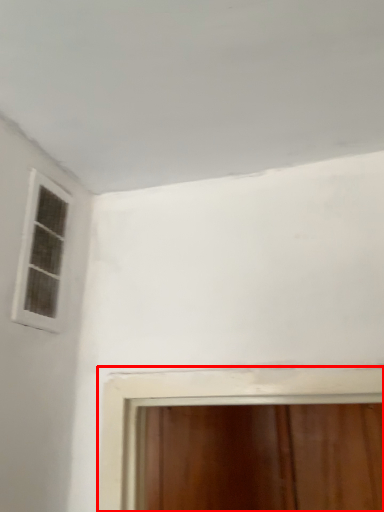
Question: In this image, where is window (annotated by the red box) located relative to window?

Choices:
 (A) left
 (B) right

Answer: (B)